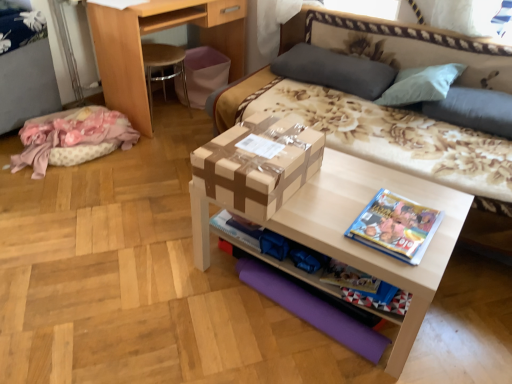
Find the location of a particular element. Image resolution: width=512 pixels, height=384 pixels. free point below blue glossy book at right (from a real-world perspective) is located at coordinates (394, 228).